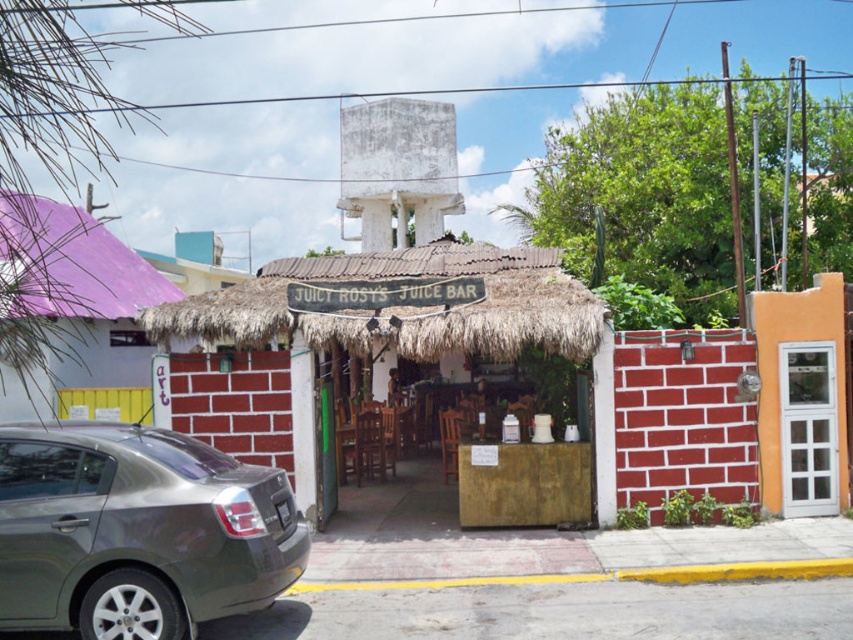
Question: Which of the following is the closest to the observer?

Choices:
 (A) thatched straw hut at center
 (B) white glass door at center
 (C) metallic gray sedan at lower left

Answer: (C)

Question: In this image, where is thatched straw hut at center located relative to white glass door at center?

Choices:
 (A) above
 (B) below

Answer: (A)

Question: Which point is closer to the camera?

Choices:
 (A) click(x=781, y=397)
 (B) click(x=254, y=552)
 (C) click(x=415, y=323)
 (D) click(x=62, y=348)

Answer: (B)

Question: Is metallic gray sedan at lower left further to the viewer compared to matte purple thatched roof hut at left?

Choices:
 (A) yes
 (B) no

Answer: (A)

Question: Can you confirm if metallic gray sedan at lower left is wider than white glass door at center?

Choices:
 (A) yes
 (B) no

Answer: (A)

Question: Which is farther from the white glass door at center?

Choices:
 (A) matte purple thatched roof hut at left
 (B) thatched straw hut at center

Answer: (A)